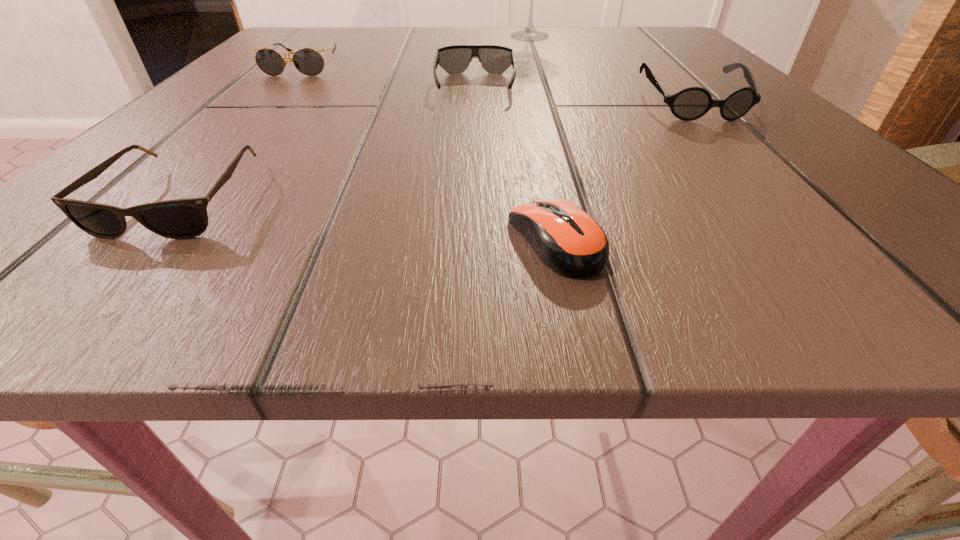
Where is `vacant space at the right edge`? vacant space at the right edge is located at coordinates (780, 151).

Where is `vacant space at the far left corner`? vacant space at the far left corner is located at coordinates (290, 49).

Identify the location of free spot at the near left corner of the desktop. (199, 237).

What are the coordinates of `free location at the far right corner` in the screenshot? It's located at (669, 32).

The width and height of the screenshot is (960, 540). In order to click on free space that is in between the rightmost object and the tallest object in this screenshot , I will do `click(612, 70)`.

I want to click on empty space between the second sunglasses from right to left and the rightmost sunglasses, so click(584, 95).

Where is `free point between the rightmost sunglasses and the second sunglasses from right to left`? free point between the rightmost sunglasses and the second sunglasses from right to left is located at coordinates (584, 95).

Image resolution: width=960 pixels, height=540 pixels. I want to click on free spot between the rightmost object and the martini, so click(612, 70).

Identify the location of unoccupied area between the computer mouse and the tallest object. Image resolution: width=960 pixels, height=540 pixels. (542, 138).

The image size is (960, 540). I want to click on object that ranks as the second closest to the shortest object, so click(187, 218).